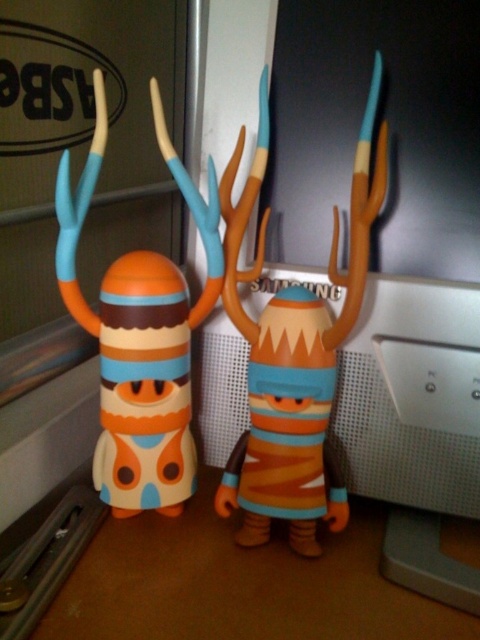
From the picture: You are organizing a shelf and need to place both the matte plastic toy at center and the matte plastic toy at left. If you want to arrange them so that the taller toy is on the bottom shelf and the shorter one on top, which toy should go where?

The matte plastic toy at left is taller than the matte plastic toy at center. Therefore, the taller matte plastic toy at left should be placed on the bottom shelf, and the shorter matte plastic toy at center should be placed on the top shelf.

You are organizing a shelf and need to place both the matte plastic toy at center and the matte plastic toy at left. If you want to place them side by side without overlapping, which toy should you place first to ensure there is enough space?

The matte plastic toy at left should be placed first because it has a greater width than the matte plastic toy at center, ensuring enough space when placing them side by side.